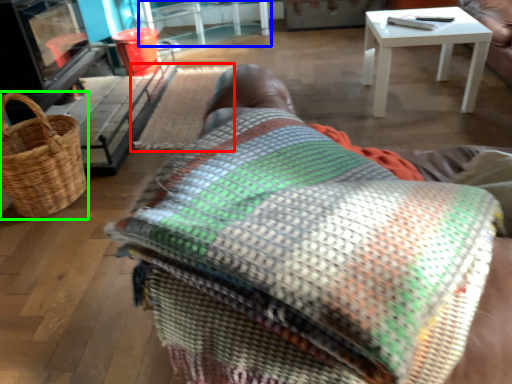
Question: Which is nearer to the mat (highlighted by a red box)? table (highlighted by a blue box) or picnic basket (highlighted by a green box).

Choices:
 (A) table
 (B) picnic basket

Answer: (B)